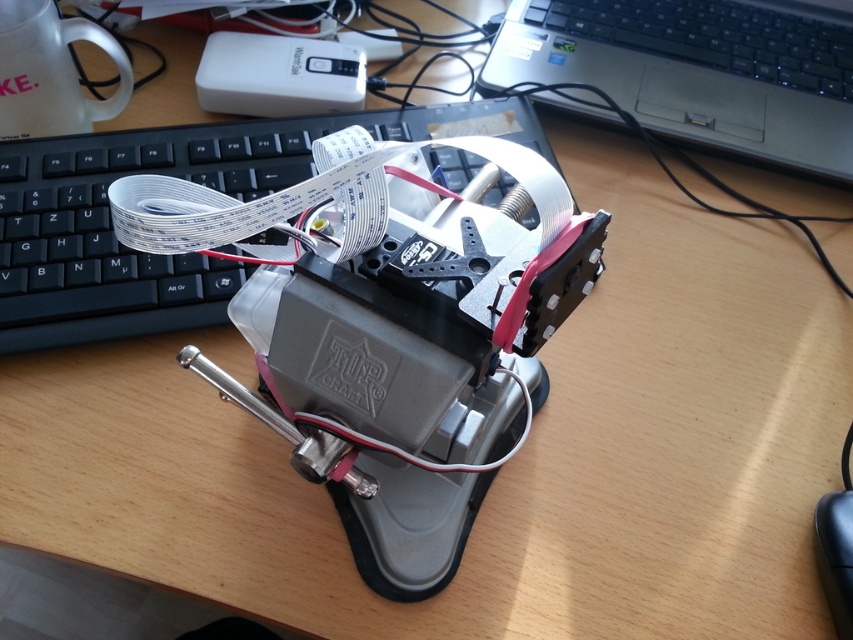
From the picture: You are setting up a new 3D printer and need to place your black plastic keyboard at center and black plastic mouse at lower right on the desk. The keyboard is 19.75 inches away from the mouse. If your arm can comfortably reach 22 inches, will you be able to move the mouse from the keyboard without stretching?

The black plastic keyboard at center is 19.75 inches away from the black plastic mouse at lower right. Since your arm can reach 22 inches, you can comfortably move the mouse from the keyboard without stretching.

You are holding a tool that requires precise placement at a distance of 60 centimeters from the viewer. Can you place it at point (99, 326)?

The distance of point (99, 326) from the viewer is 58.83 centimeters, so placing the tool there would be 1.17 centimeters too close.

You are setting up a new computer workstation and need to place the black plastic keyboard at center and the black plastic mouse at lower right. According to the image, where should you place the keyboard relative to the mouse?

The black plastic keyboard at center is positioned over the black plastic mouse at lower right, so you should place the keyboard directly above the mouse.